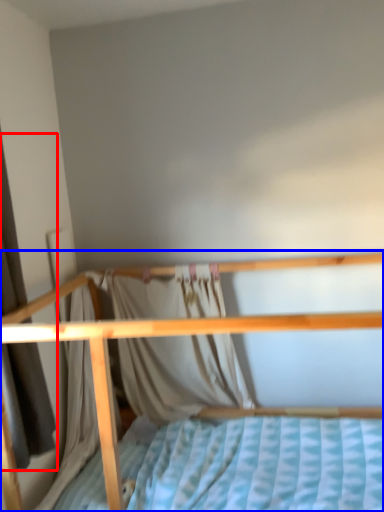
Question: Which object is closer to the camera taking this photo, curtain (highlighted by a red box) or bed (highlighted by a blue box)?

Choices:
 (A) curtain
 (B) bed

Answer: (B)